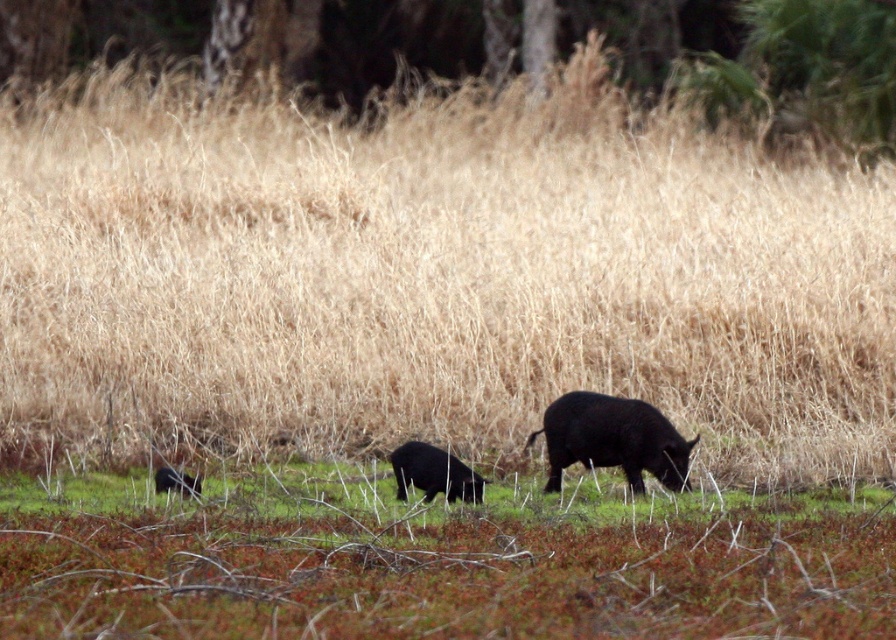
Question: Does shiny black boar at center appear on the left side of shiny black bear at lower left?

Choices:
 (A) no
 (B) yes

Answer: (A)

Question: Where is shiny black boar at center located in relation to black matte pig at center in the image?

Choices:
 (A) below
 (B) above

Answer: (B)

Question: Is black matte pig at center above shiny black bear at lower left?

Choices:
 (A) no
 (B) yes

Answer: (A)

Question: Which is farther from the shiny black boar at center?

Choices:
 (A) black matte pig at center
 (B) shiny black bear at lower left

Answer: (B)

Question: Among these points, which one is farthest from the camera?

Choices:
 (A) (397, 458)
 (B) (192, 477)
 (C) (552, 429)

Answer: (C)

Question: Which point is farther to the camera?

Choices:
 (A) shiny black boar at center
 (B) shiny black bear at lower left
 (C) black matte pig at center

Answer: (C)